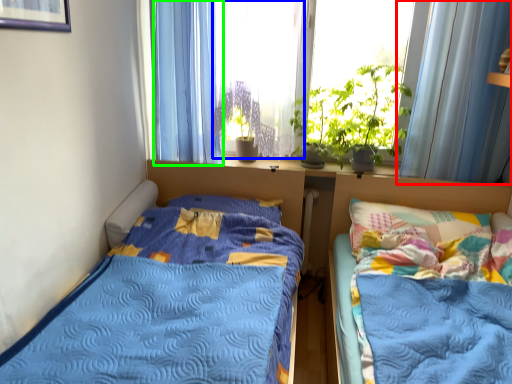
Question: Which object is positioned closest to curtain (highlighted by a red box)? Select from window screen (highlighted by a blue box) and curtain (highlighted by a green box).

Choices:
 (A) window screen
 (B) curtain

Answer: (A)